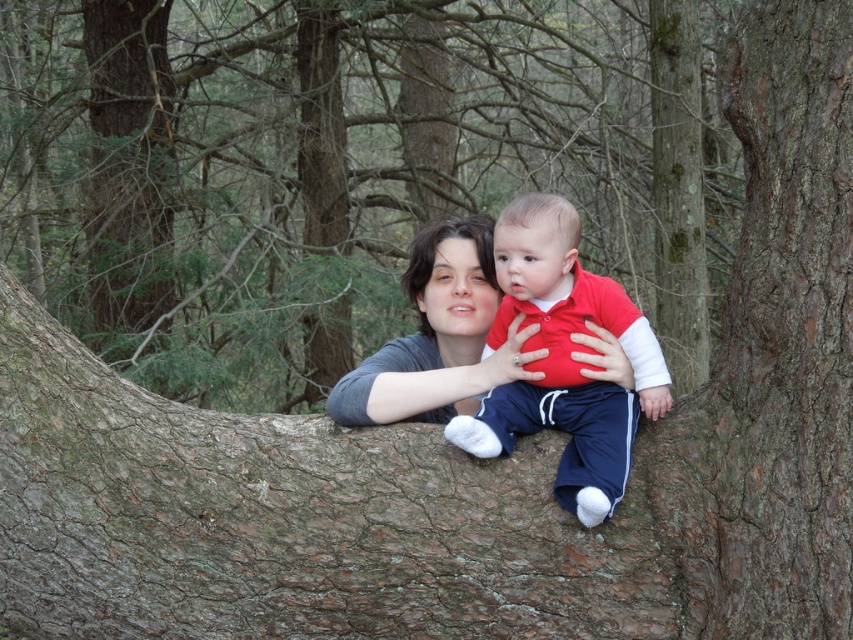
You are a photographer trying to capture a closeup shot of the matte red shirt at center and the matte gray sweater at center. Your camera can only focus on objects within a 10 inch range. Will both items be in focus?

The matte red shirt at center is 9.63 inches away from the matte gray sweater at center. Since the distance between them is within the 10 inch range, both items will be in focus.

You are a photographer taking a picture of the matte red shirt at center and the matte gray sweater at center. Which one is closer to the camera?

The matte red shirt at center is closer to the camera because it is in front of the matte gray sweater at center.